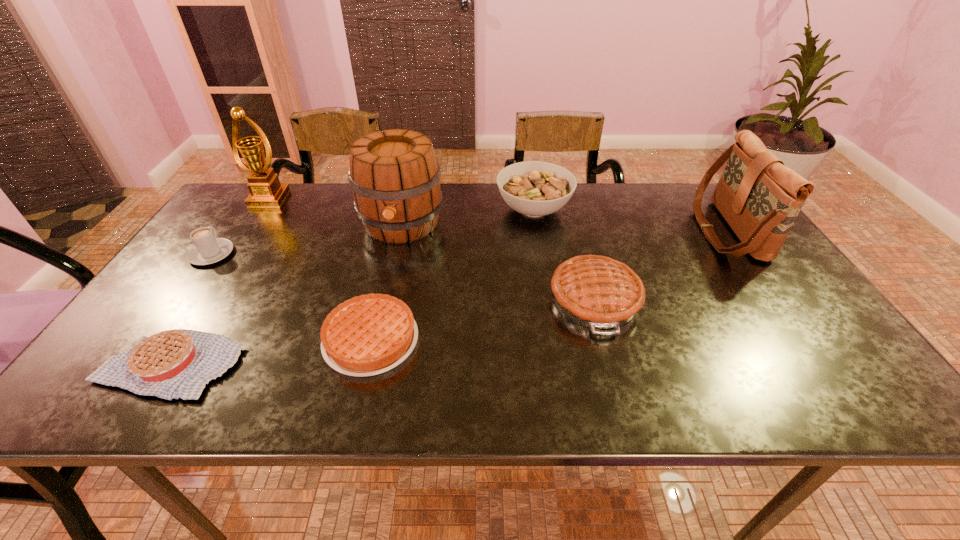
This screenshot has height=540, width=960. Find the location of `free space located 0.130m on the right of the leftmost pie`. free space located 0.130m on the right of the leftmost pie is located at coordinates (300, 364).

The width and height of the screenshot is (960, 540). What are the coordinates of `award located at the far edge` in the screenshot? It's located at (265, 189).

You are a GUI agent. You are given a task and a screenshot of the screen. Output one action in this format:
    pyautogui.click(x=<x>, y=<y>)
    Task: Click on the cider that is at the far edge
    This screenshot has width=960, height=540.
    Given the screenshot: What is the action you would take?
    pyautogui.click(x=395, y=177)

Where is `shoulder bag present at the far edge`? This screenshot has height=540, width=960. shoulder bag present at the far edge is located at coordinates (760, 198).

This screenshot has width=960, height=540. Identify the location of stew positioned at the far edge. (534, 188).

Image resolution: width=960 pixels, height=540 pixels. What are the coordinates of `award that is at the left edge` in the screenshot? It's located at (265, 189).

At what (x,y) coordinates should I click in order to perform the action: click on cappuccino situated at the left edge. Please return your answer as a coordinate pair (x, y). This screenshot has width=960, height=540. Looking at the image, I should click on click(208, 249).

Locate an element on the screen. pie located at the left edge is located at coordinates (177, 363).

Where is `object that is positioned at the right edge`? object that is positioned at the right edge is located at coordinates (760, 198).

The width and height of the screenshot is (960, 540). Identify the location of object present at the far left corner. (265, 189).